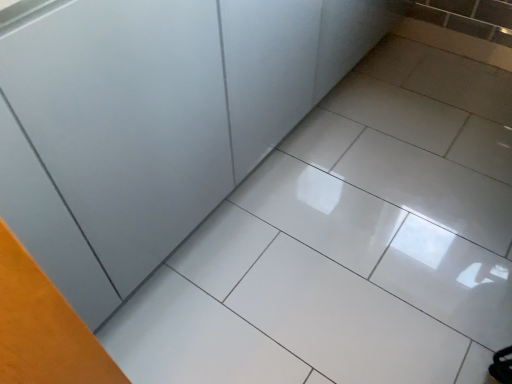
The width and height of the screenshot is (512, 384). In order to click on matte gray screen door at lower left in this screenshot , I will do [125, 121].

Describe the element at coordinates (125, 121) in the screenshot. I see `matte gray screen door at lower left` at that location.

I want to click on matte gray screen door at lower left, so click(125, 121).